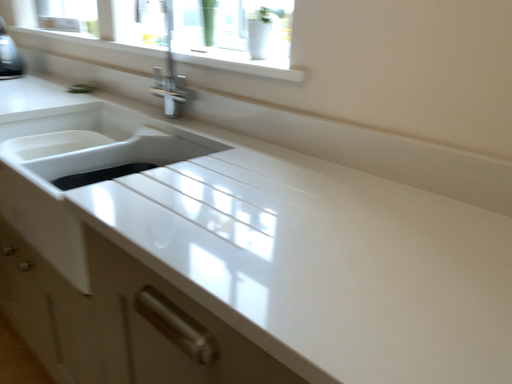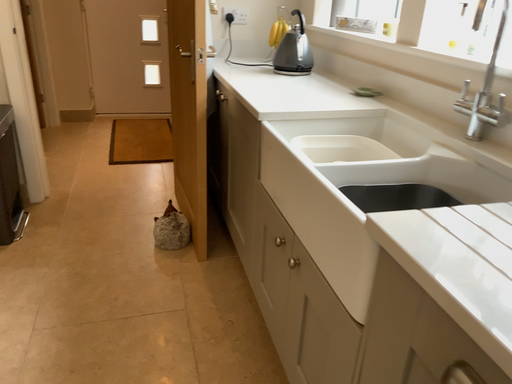
Question: Which way did the camera rotate in the video?

Choices:
 (A) rotated left
 (B) rotated right

Answer: (A)